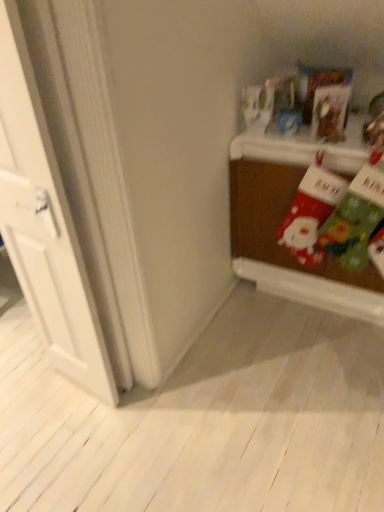
Question: From their relative heights in the image, would you say wooden table at right is taller or shorter than white wood door at left?

Choices:
 (A) tall
 (B) short

Answer: (B)

Question: Looking at their shapes, would you say wooden table at right is wider or thinner than white wood door at left?

Choices:
 (A) wide
 (B) thin

Answer: (A)

Question: From the image's perspective, relative to white wood door at left, is wooden table at right above or below?

Choices:
 (A) above
 (B) below

Answer: (A)

Question: Would you say white wood door at left is to the left or to the right of wooden table at right in the picture?

Choices:
 (A) left
 (B) right

Answer: (A)

Question: Is white wood door at left wider or thinner than wooden table at right?

Choices:
 (A) wide
 (B) thin

Answer: (B)

Question: Considering the positions of white wood door at left and wooden table at right in the image, is white wood door at left taller or shorter than wooden table at right?

Choices:
 (A) tall
 (B) short

Answer: (A)

Question: Is white wood door at left inside or outside of wooden table at right?

Choices:
 (A) outside
 (B) inside

Answer: (A)